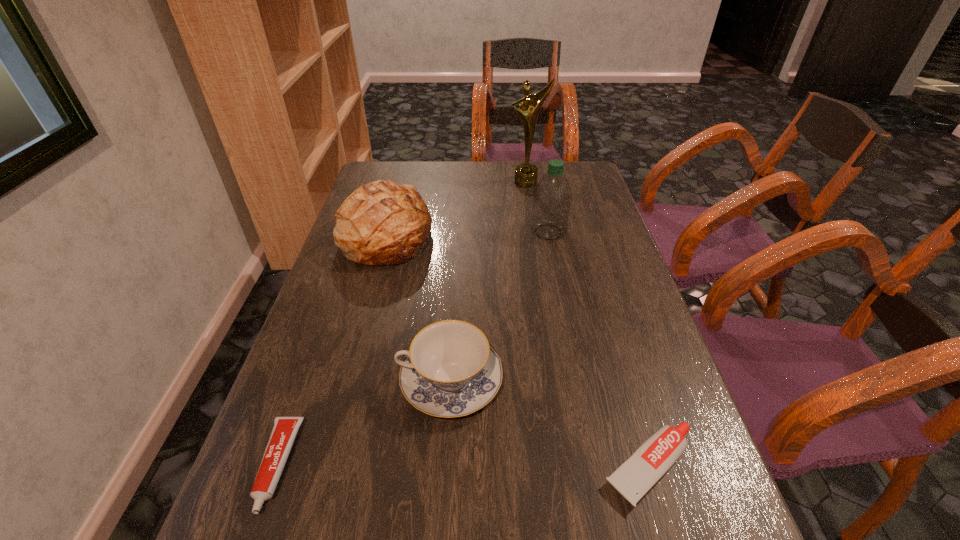
Identify the location of vacant space located on the back of the fifth shortest object. (x=535, y=167).

Where is `free space located 0.350m on the front of the third tallest object`? The width and height of the screenshot is (960, 540). free space located 0.350m on the front of the third tallest object is located at coordinates (347, 382).

Locate an element on the screen. The width and height of the screenshot is (960, 540). blank space located 0.130m with the handle on the side of the third shortest object is located at coordinates (333, 381).

Locate an element on the screen. free space located with the handle on the side of the third shortest object is located at coordinates (289, 381).

The height and width of the screenshot is (540, 960). I want to click on vacant space located with the handle on the side of the third shortest object, so click(x=328, y=381).

Locate an element on the screen. Image resolution: width=960 pixels, height=540 pixels. vacant space located 0.110m on the back of the right toothpaste is located at coordinates (624, 379).

Where is `object situated at the far edge`? object situated at the far edge is located at coordinates (525, 175).

What are the coordinates of `bread at the left edge` in the screenshot? It's located at (381, 223).

This screenshot has height=540, width=960. Identify the location of toothpaste that is positioned at the left edge. (284, 431).

Locate an element on the screen. water bottle that is positioned at the right edge is located at coordinates (552, 197).